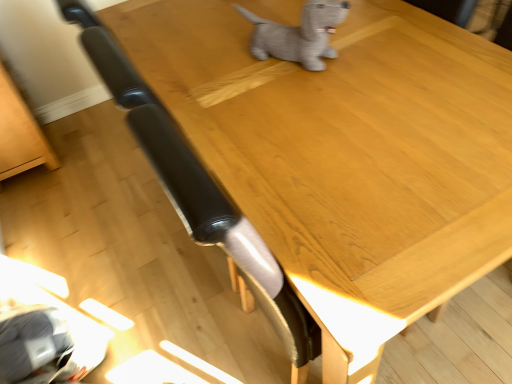
Locate an element on the screen. This screenshot has height=384, width=512. free spot to the right of gray plush dog at upper center is located at coordinates (373, 47).